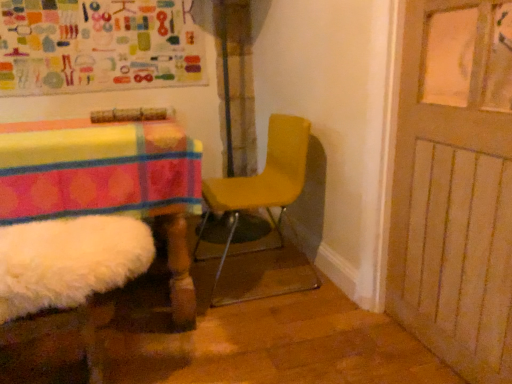
You are a GUI agent. You are given a task and a screenshot of the screen. Output one action in this format:
    pyautogui.click(x=<x>, y=<y>)
    Task: Click on the yellow matte chair at center
    
    Given the screenshot: What is the action you would take?
    pyautogui.click(x=268, y=214)

The width and height of the screenshot is (512, 384). What are the coordinates of `colorful fabric bulletin board at upper left` in the screenshot? It's located at (98, 46).

What do you see at coordinates (98, 46) in the screenshot? The image size is (512, 384). I see `colorful fabric bulletin board at upper left` at bounding box center [98, 46].

I want to click on wooden door at right, so click(455, 186).

Can we say yellow matte chair at center lies outside wooden door at right?

That's correct, yellow matte chair at center is outside of wooden door at right.

Can you confirm if yellow matte chair at center is thinner than wooden door at right?

Incorrect, the width of yellow matte chair at center is not less than that of wooden door at right.

Are yellow matte chair at center and wooden door at right far apart?

yellow matte chair at center is near wooden door at right, not far away.

Is yellow matte chair at center oriented away from wooden door at right?

No, yellow matte chair at center is not facing the opposite direction of wooden door at right.

Who is more distant, wooden door at right or colorful fabric bulletin board at upper left?

colorful fabric bulletin board at upper left is further from the camera.

Which is behind, point (506, 187) or point (145, 44)?

The point (145, 44) is farther from the camera.

Is wooden door at right aimed at colorful fabric bulletin board at upper left?

No, wooden door at right is not aimed at colorful fabric bulletin board at upper left.

In the scene shown: From the image's perspective, between wooden door at right and colorful fabric bulletin board at upper left, which one is located above?

colorful fabric bulletin board at upper left appears higher in the image.

Which is farther from the camera, (403, 250) or (249, 188)?

The point (249, 188) is more distant.

Which of these two, wooden door at right or yellow matte chair at center, is smaller?

Smaller between the two is wooden door at right.

Is yellow matte chair at center at the back of wooden door at right?

No, wooden door at right is not facing the opposite direction of yellow matte chair at center.

Is wooden door at right closer to camera compared to yellow matte chair at center?

Yes, wooden door at right is closer to the camera.

Considering the sizes of objects colorful fabric bulletin board at upper left and wooden door at right in the image provided, who is taller, colorful fabric bulletin board at upper left or wooden door at right?

wooden door at right.

Can you tell me how much colorful fabric bulletin board at upper left and wooden door at right differ in facing direction?

The angular difference between colorful fabric bulletin board at upper left and wooden door at right is 89.1 degrees.

From a real-world perspective, which is physically above, colorful fabric bulletin board at upper left or wooden door at right?

From a 3D spatial view, colorful fabric bulletin board at upper left is above.

From the picture: Is colorful fabric bulletin board at upper left touching wooden door at right?

colorful fabric bulletin board at upper left and wooden door at right are not in contact.

Is point (298, 284) closer or farther from the camera than point (54, 63)?

Clearly, point (298, 284) is closer to the camera than point (54, 63).

In terms of size, does yellow matte chair at center appear bigger or smaller than colorful fabric bulletin board at upper left?

Considering their sizes, yellow matte chair at center takes up more space than colorful fabric bulletin board at upper left.

How far apart are yellow matte chair at center and colorful fabric bulletin board at upper left?

They are 3.78 feet apart.

Is yellow matte chair at center taller or shorter than colorful fabric bulletin board at upper left?

Clearly, yellow matte chair at center is taller compared to colorful fabric bulletin board at upper left.

Does point (83, 87) appear closer or farther from the camera than point (214, 283)?

Clearly, point (83, 87) is more distant from the camera than point (214, 283).

Is colorful fabric bulletin board at upper left completely or partially outside of yellow matte chair at center?

Yes, colorful fabric bulletin board at upper left is not within yellow matte chair at center.

In terms of width, does colorful fabric bulletin board at upper left look wider or thinner when compared to yellow matte chair at center?

Considering their sizes, colorful fabric bulletin board at upper left looks slimmer than yellow matte chair at center.

The width and height of the screenshot is (512, 384). Find the location of `chair located below the wooden door at right (from the image's perspective)`. chair located below the wooden door at right (from the image's perspective) is located at coordinates 268,214.

Locate an element on the screen. Image resolution: width=512 pixels, height=384 pixels. bulletin board lying above the wooden door at right (from the image's perspective) is located at coordinates (98, 46).

From the image, which object appears to be farther from yellow matte chair at center, colorful fabric bulletin board at upper left or wooden door at right?

Based on the image, colorful fabric bulletin board at upper left appears to be further to yellow matte chair at center.

From the image, which object appears to be farther from yellow matte chair at center, wooden door at right or colorful fabric bulletin board at upper left?

colorful fabric bulletin board at upper left.

Considering their positions, is wooden door at right positioned further to colorful fabric bulletin board at upper left than yellow matte chair at center?

Based on the image, wooden door at right appears to be further to colorful fabric bulletin board at upper left.

Considering their positions, is yellow matte chair at center positioned further to colorful fabric bulletin board at upper left than wooden door at right?

wooden door at right is further to colorful fabric bulletin board at upper left.

When comparing their distances from wooden door at right, does yellow matte chair at center or colorful fabric bulletin board at upper left seem closer?

The object closer to wooden door at right is yellow matte chair at center.

Estimate the real-world distances between objects in this image. Which object is closer to wooden door at right, colorful fabric bulletin board at upper left or yellow matte chair at center?

Among the two, yellow matte chair at center is located nearer to wooden door at right.

Locate an element on the screen. The image size is (512, 384). chair located between colorful fabric bulletin board at upper left and wooden door at right in the left-right direction is located at coordinates (268, 214).